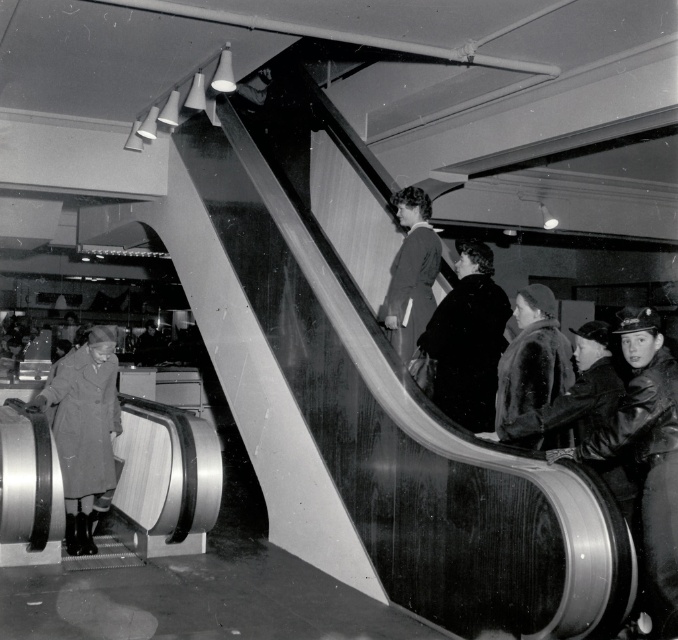
You are standing at the point marked as point (559, 381) in the shopping mall. The escalator is moving upwards. If you want to reach the upper floor quickly, should you take the escalator or walk towards the nearest staircase?

Since you are 4.34 meters away from the viewer, you should take the escalator to reach the upper floor quickly because it is closer than walking to the staircase.

You are a tailor observing two coats at the center of a 1950s mall escalator scene. The coats are both at the center but differ in size. Which coat would require more fabric to make, the dark wool coat at center or the smooth fabric coat at center?

The dark wool coat at center requires more fabric because it is bigger than the smooth fabric coat at center.